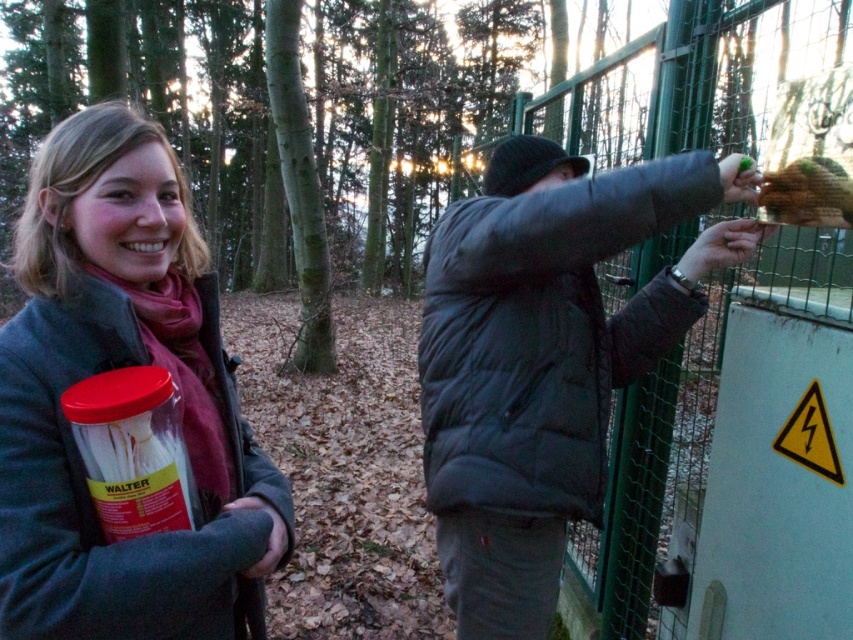
Question: Which is farther from the dark gray puffer jacket at center?

Choices:
 (A) green matte food at upper right
 (B) matte gray coat at center

Answer: (B)

Question: Which point is farther to the camera?

Choices:
 (A) matte gray coat at center
 (B) dark gray puffer jacket at center
 (C) green matte food at upper right

Answer: (C)

Question: Is dark gray puffer jacket at center bigger than green matte food at upper right?

Choices:
 (A) no
 (B) yes

Answer: (B)

Question: Among these objects, which one is nearest to the camera?

Choices:
 (A) dark gray puffer jacket at center
 (B) matte gray coat at center
 (C) green matte food at upper right

Answer: (B)

Question: Is matte gray coat at center bigger than green matte food at upper right?

Choices:
 (A) no
 (B) yes

Answer: (B)

Question: Is dark gray puffer jacket at center further to camera compared to green matte food at upper right?

Choices:
 (A) yes
 (B) no

Answer: (B)